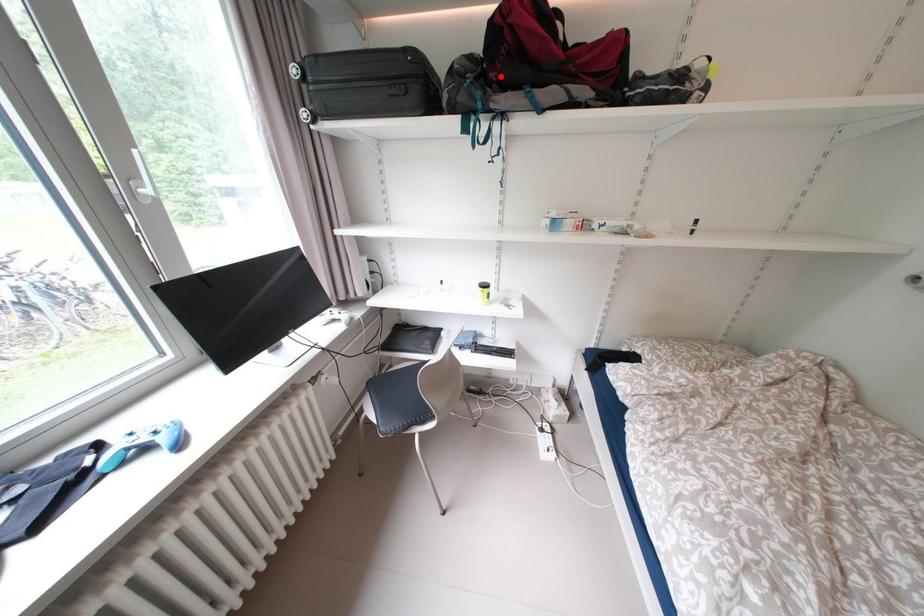
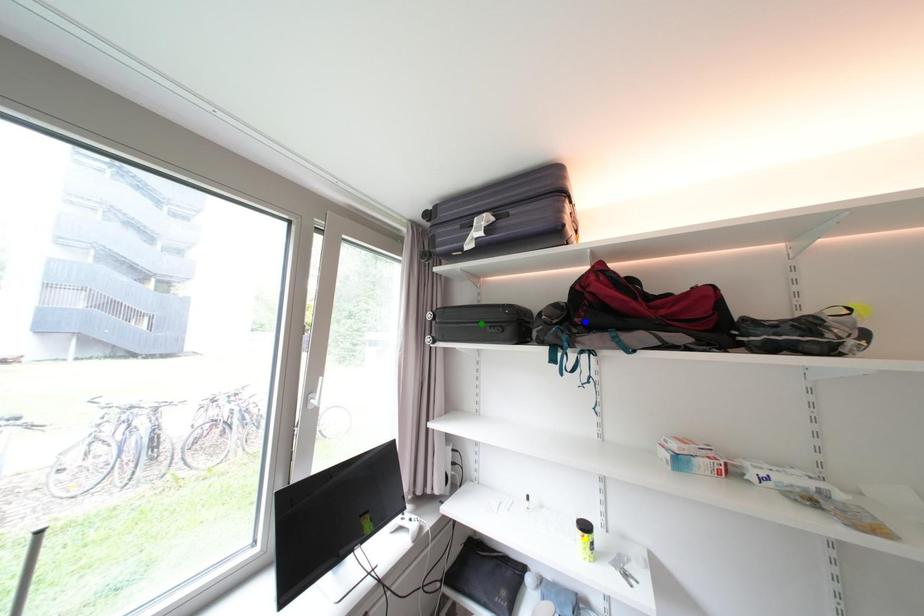
Question: I am providing you with two images of the same scene from different viewpoints. A red point is marked on the first image. You are given multiple points on the second image. Can you choose the point in image 2 that corresponds to the point in image 1?

Choices:
 (A) yellow point
 (B) green point
 (C) blue point

Answer: (C)